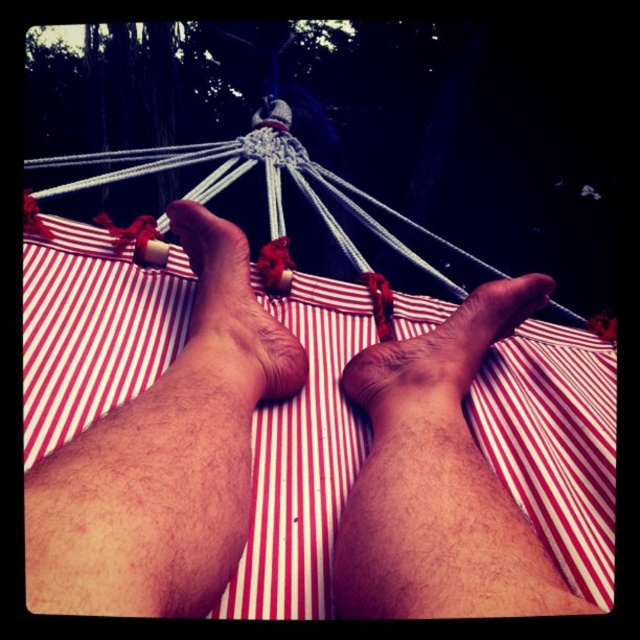
Question: Based on their relative distances, which object is nearer to the brown skin at center?

Choices:
 (A) red striped fabric foot at center
 (B) red striped fabric at center

Answer: (B)

Question: Is red striped fabric foot at center closer to the viewer compared to brown skin at center?

Choices:
 (A) no
 (B) yes

Answer: (B)

Question: Among these objects, which one is nearest to the camera?

Choices:
 (A) brown skin at center
 (B) red striped fabric at center

Answer: (B)

Question: Does red striped fabric at center have a smaller size compared to red striped fabric foot at center?

Choices:
 (A) yes
 (B) no

Answer: (B)

Question: Estimate the real-world distances between objects in this image. Which object is farther from the red striped fabric foot at center?

Choices:
 (A) brown skin at center
 (B) red striped fabric at center

Answer: (A)

Question: Does red striped fabric at center appear under red striped fabric foot at center?

Choices:
 (A) no
 (B) yes

Answer: (B)